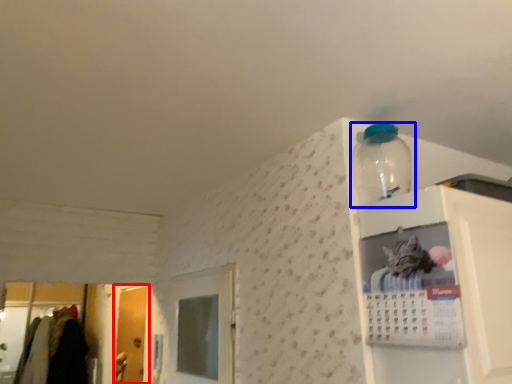
Question: Which point is closer to the camera, door (highlighted by a red box) or bottle (highlighted by a blue box)?

Choices:
 (A) door
 (B) bottle

Answer: (B)